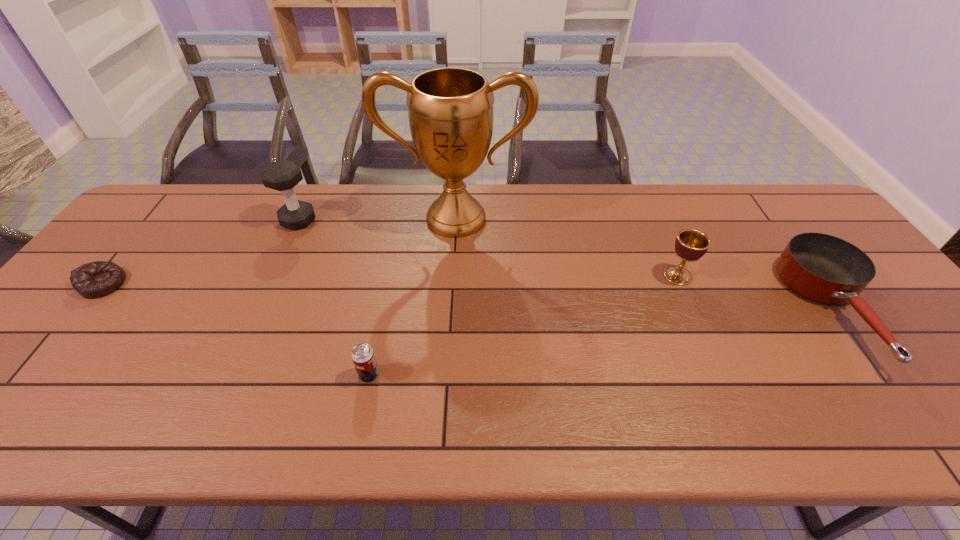
Where is `the tallest object`? the tallest object is located at coordinates (450, 110).

The height and width of the screenshot is (540, 960). In order to click on the fifth shortest object in this screenshot , I will do `click(283, 175)`.

I want to click on the fifth object from right to left, so click(x=283, y=175).

Find the location of a particular element. The width and height of the screenshot is (960, 540). chalice is located at coordinates (690, 245).

The image size is (960, 540). Identify the location of the fourth shortest object. (690, 245).

Find the location of `beer can`. beer can is located at coordinates (363, 357).

Identify the location of pan. This screenshot has width=960, height=540. (826, 269).

At what (x,y) coordinates should I click in order to perform the action: click on the shortest object. Please return your answer as a coordinate pair (x, y). Looking at the image, I should click on (93, 280).

I want to click on the leftmost object, so 93,280.

You are a GUI agent. You are given a task and a screenshot of the screen. Output one action in this format:
    pyautogui.click(x=<x>, y=<y>)
    Task: Click on the free location located on the surface of the tallest object with symbols
    
    Given the screenshot: What is the action you would take?
    pyautogui.click(x=450, y=320)